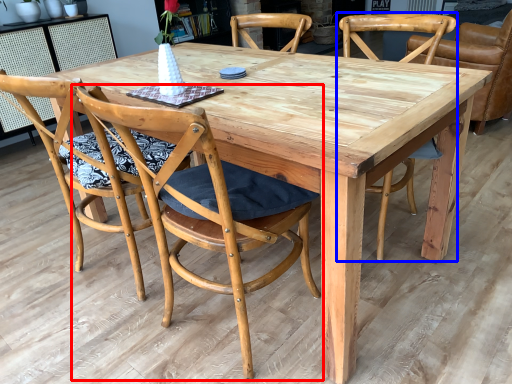
Question: Among these objects, which one is farthest to the camera, chair (highlighted by a red box) or chair (highlighted by a blue box)?

Choices:
 (A) chair
 (B) chair

Answer: (B)